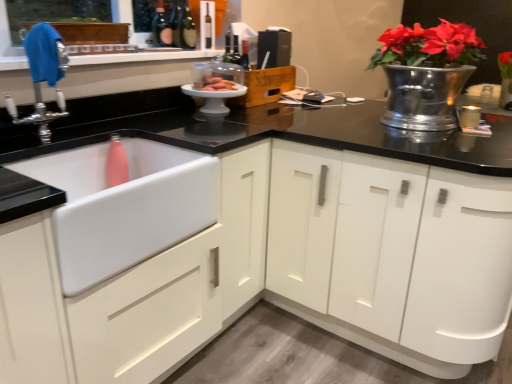
Question: Is dark brown glass wine bottle at upper center smaller than chrome metallic faucet at upper left?

Choices:
 (A) no
 (B) yes

Answer: (B)

Question: Could you tell me if dark brown glass wine bottle at upper center is facing chrome metallic faucet at upper left?

Choices:
 (A) yes
 (B) no

Answer: (B)

Question: Is dark brown glass wine bottle at upper center completely or partially outside of chrome metallic faucet at upper left?

Choices:
 (A) yes
 (B) no

Answer: (A)

Question: Considering the relative sizes of dark brown glass wine bottle at upper center and chrome metallic faucet at upper left in the image provided, is dark brown glass wine bottle at upper center shorter than chrome metallic faucet at upper left?

Choices:
 (A) no
 (B) yes

Answer: (B)

Question: From a real-world perspective, is dark brown glass wine bottle at upper center below chrome metallic faucet at upper left?

Choices:
 (A) yes
 (B) no

Answer: (B)

Question: Is chrome metallic faucet at upper left at the back of dark brown glass wine bottle at upper center?

Choices:
 (A) no
 (B) yes

Answer: (A)

Question: Is the depth of white ceramic cake stand at center, which appears as the 1th appliance when viewed from the front, greater than that of chrome metallic faucet at upper left?

Choices:
 (A) yes
 (B) no

Answer: (A)

Question: Is white ceramic cake stand at center, which appears as the 1th appliance when viewed from the front, positioned with its back to chrome metallic faucet at upper left?

Choices:
 (A) yes
 (B) no

Answer: (B)

Question: Considering the relative sizes of white ceramic cake stand at center, the 2th appliance in the top-to-bottom sequence, and chrome metallic faucet at upper left in the image provided, is white ceramic cake stand at center, the 2th appliance in the top-to-bottom sequence, taller than chrome metallic faucet at upper left?

Choices:
 (A) yes
 (B) no

Answer: (B)

Question: Considering the relative sizes of white ceramic cake stand at center, the 2th appliance in the top-to-bottom sequence, and chrome metallic faucet at upper left in the image provided, is white ceramic cake stand at center, the 2th appliance in the top-to-bottom sequence, shorter than chrome metallic faucet at upper left?

Choices:
 (A) yes
 (B) no

Answer: (A)

Question: Is white ceramic cake stand at center, the 2th appliance in the top-to-bottom sequence, completely or partially outside of chrome metallic faucet at upper left?

Choices:
 (A) no
 (B) yes

Answer: (B)

Question: Is chrome metallic faucet at upper left surrounded by white ceramic cake stand at center, the 2th appliance in the top-to-bottom sequence?

Choices:
 (A) no
 (B) yes

Answer: (A)

Question: Is white ceramic cake stand at center, the first appliance in the bottom-to-top sequence, positioned far away from white matte sink at lower left?

Choices:
 (A) yes
 (B) no

Answer: (B)